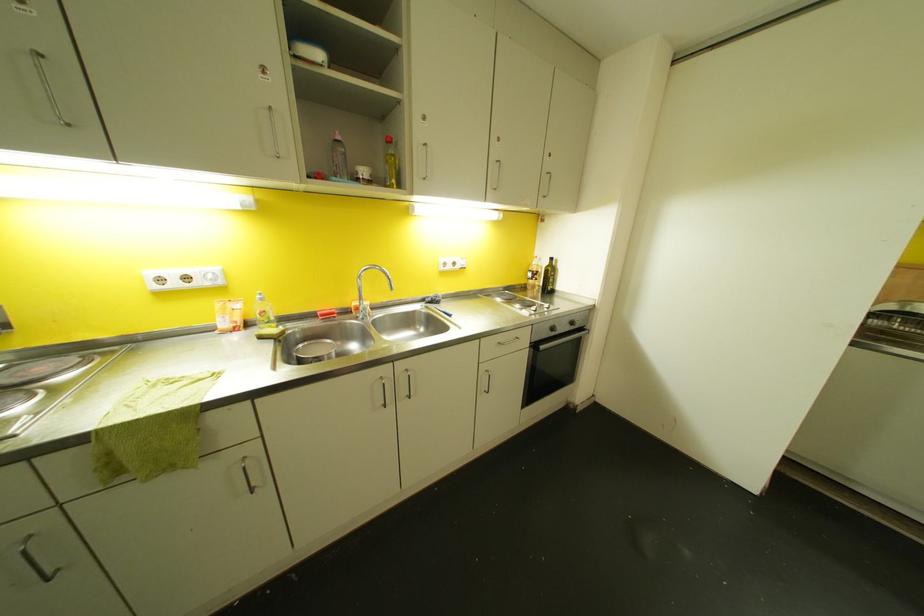
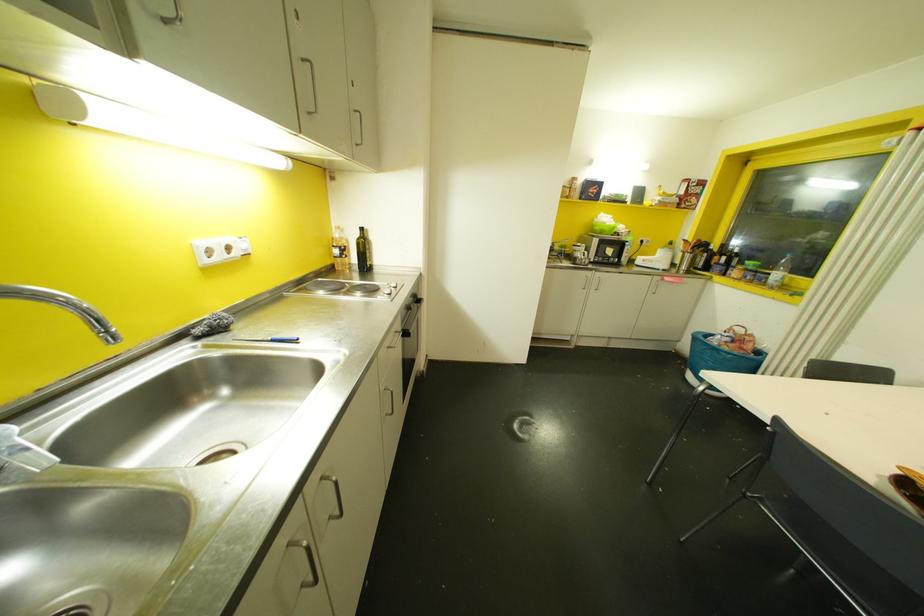
Where in the second image is the point corresponding to (529,274) from the first image?

(335, 251)